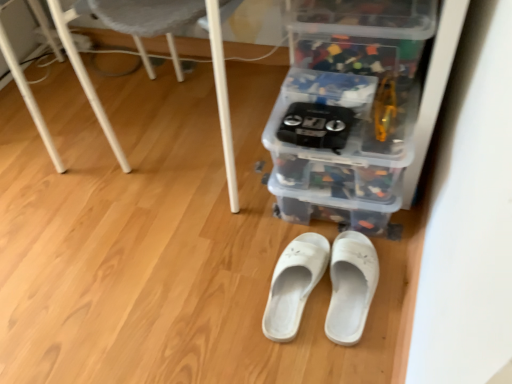
Where is `free space in front of translucent plastic storage box at center, the 3th storage box in the bottom-to-top sequence`? The width and height of the screenshot is (512, 384). free space in front of translucent plastic storage box at center, the 3th storage box in the bottom-to-top sequence is located at coordinates (348, 97).